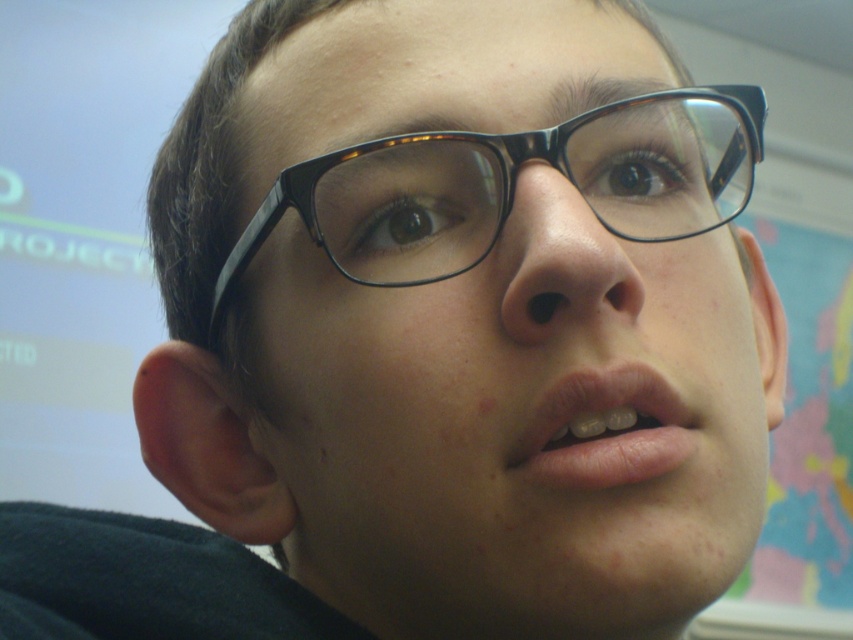
You are a photographer standing at a certain distance from the black plastic glasses at center. You need to capture a clear photo of the glasses. According to the scene description, what is the minimum distance you should maintain to ensure the glasses are in focus?

The minimum distance you should maintain is 11.68 inches from the black plastic glasses at center to ensure they are in focus.

You are a makeup artist trying to apply lipstick to the pink matte lips at center. However, the person is wearing black plastic glasses at center. Based on the scene, can you apply the lipstick without removing the glasses?

The black plastic glasses at center are positioned over the pink matte lips at center, so you cannot apply the lipstick without removing the glasses first.